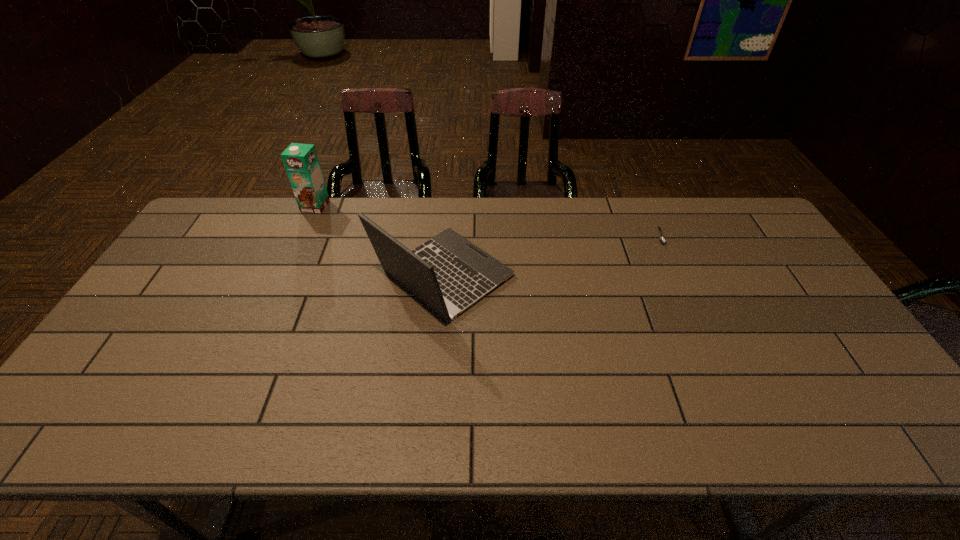
The image size is (960, 540). In order to click on soupspoon at the far edge in this screenshot , I will do `click(661, 239)`.

You are a GUI agent. You are given a task and a screenshot of the screen. Output one action in this format:
    pyautogui.click(x=<x>, y=<y>)
    Task: Click on the vacant region at the far edge of the desktop
    The image size is (960, 540).
    Given the screenshot: What is the action you would take?
    pyautogui.click(x=604, y=213)

In the image, there is a desktop. Where is `vacant area at the near edge`? Image resolution: width=960 pixels, height=540 pixels. vacant area at the near edge is located at coordinates (x=296, y=424).

Find the location of `vacant space at the left edge of the desktop`. vacant space at the left edge of the desktop is located at coordinates (184, 271).

In the image, there is a desktop. At what (x,y) coordinates should I click in order to perform the action: click on vacant region at the right edge. Please return your answer as a coordinate pair (x, y). Looking at the image, I should click on (787, 345).

I want to click on free location at the far left corner, so click(x=227, y=236).

Where is `vacant region between the laptop_computer and the rightmost object`? vacant region between the laptop_computer and the rightmost object is located at coordinates (552, 256).

This screenshot has width=960, height=540. Find the location of `blank region between the shortest object and the laptop_computer`. blank region between the shortest object and the laptop_computer is located at coordinates (552, 256).

At what (x,y) coordinates should I click in order to perform the action: click on unoccupied position between the shortest object and the second object from left to right. Please return your answer as a coordinate pair (x, y). The width and height of the screenshot is (960, 540). Looking at the image, I should click on (552, 256).

The image size is (960, 540). I want to click on free point between the shortest object and the laptop_computer, so [x=552, y=256].